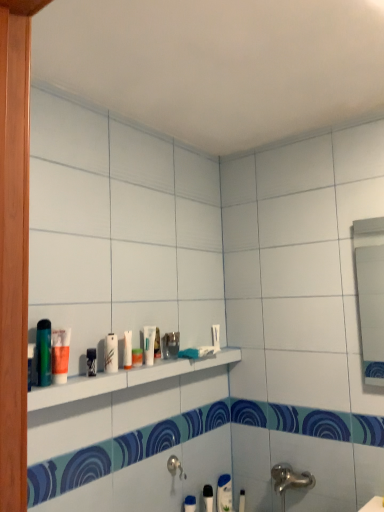
Question: Is black plastic toothbrush at lower center, the 2th toiletry positioned from the right, turned away from white glossy tube at center, acting as the fourth toiletry starting from the right?

Choices:
 (A) yes
 (B) no

Answer: (B)

Question: Is black plastic toothbrush at lower center, the 2th toiletry positioned from the right, positioned far away from white glossy tube at center, which is the fourth toiletry in back-to-front order?

Choices:
 (A) yes
 (B) no

Answer: (B)

Question: From the image's perspective, is black plastic toothbrush at lower center, the sixth toiletry in the left-to-right sequence, on white glossy tube at center, acting as the fourth toiletry starting from the right?

Choices:
 (A) yes
 (B) no

Answer: (B)

Question: Is black plastic toothbrush at lower center, the sixth toiletry in the left-to-right sequence, oriented towards white glossy tube at center, the 4th toiletry from the top?

Choices:
 (A) no
 (B) yes

Answer: (A)

Question: Can you confirm if black plastic toothbrush at lower center, which is the second toiletry in back-to-front order, is wider than white glossy tube at center, the 4th toiletry viewed from the front?

Choices:
 (A) no
 (B) yes

Answer: (B)

Question: Is white matte toothpaste at center, the 1th toothpaste from the left, inside or outside of white matte toothpaste at lower right, the first toothpaste in the bottom-to-top sequence?

Choices:
 (A) inside
 (B) outside

Answer: (B)

Question: From a real-world perspective, is white matte toothpaste at center, the 1th toothpaste from the left, above or below white matte toothpaste at lower right, the second toothpaste positioned from the front?

Choices:
 (A) above
 (B) below

Answer: (A)

Question: Is white matte toothpaste at center, positioned as the 2th toothpaste in back-to-front order, wider or thinner than white matte toothpaste at lower right, acting as the first toothpaste starting from the back?

Choices:
 (A) wide
 (B) thin

Answer: (A)

Question: Is point (127, 335) closer or farther from the camera than point (218, 485)?

Choices:
 (A) farther
 (B) closer

Answer: (B)

Question: Is white matte toothpaste at lower right, acting as the first toothpaste starting from the back, spatially inside white glossy tube at center, the 4th toiletry viewed from the front, or outside of it?

Choices:
 (A) outside
 (B) inside

Answer: (A)

Question: Considering the positions of point click(218, 493) and point click(145, 361), is point click(218, 493) closer or farther from the camera than point click(145, 361)?

Choices:
 (A) farther
 (B) closer

Answer: (A)

Question: Is white matte toothpaste at lower right, arranged as the 2th toothpaste when viewed from the top, taller or shorter than white glossy tube at center, acting as the fourth toiletry starting from the right?

Choices:
 (A) tall
 (B) short

Answer: (A)

Question: In terms of width, does white matte toothpaste at lower right, the first toothpaste in the bottom-to-top sequence, look wider or thinner when compared to white glossy tube at center, the 4th toiletry from the top?

Choices:
 (A) wide
 (B) thin

Answer: (B)

Question: From a real-world perspective, relative to white matte toothpaste at center, the 2th toothpaste in the right-to-left sequence, is white glossy tube at center, the 5th toiletry from the right, vertically above or below?

Choices:
 (A) above
 (B) below

Answer: (A)

Question: Is point (115, 370) closer or farther from the camera than point (127, 357)?

Choices:
 (A) closer
 (B) farther

Answer: (A)